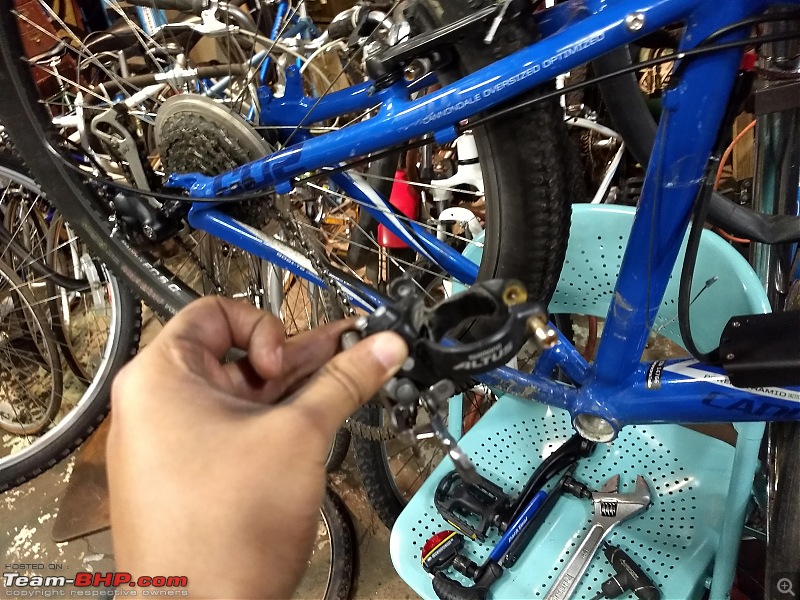
Image resolution: width=800 pixels, height=600 pixels. I want to click on cabinet, so click(42, 34).